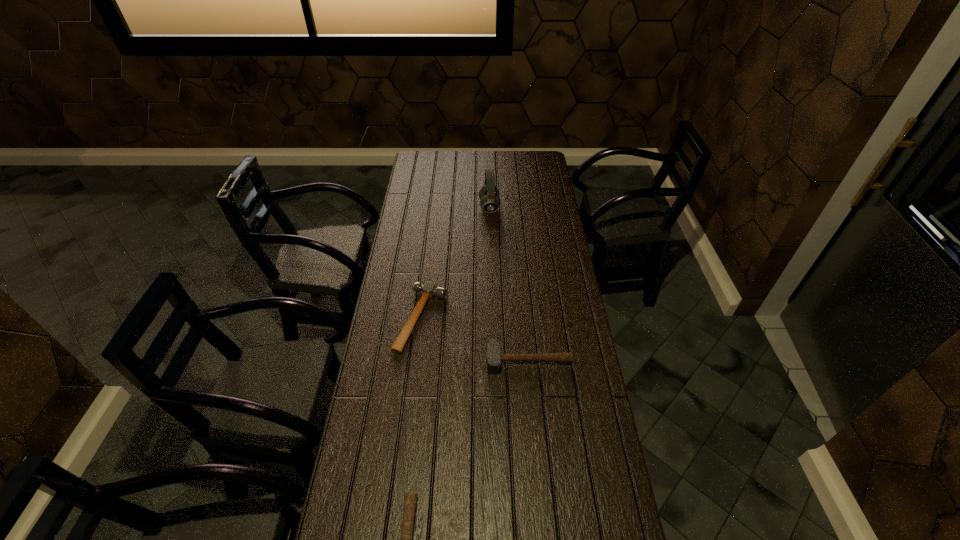
This screenshot has width=960, height=540. I want to click on the tallest object, so click(489, 198).

Image resolution: width=960 pixels, height=540 pixels. I want to click on headset, so [x=489, y=198].

The image size is (960, 540). What are the coordinates of `the rightmost hammer` in the screenshot? It's located at (493, 357).

This screenshot has height=540, width=960. Find the location of `the second shortest object`. the second shortest object is located at coordinates click(429, 289).

Locate an element on the screen. vacant space located on the ear cups of the tallest object is located at coordinates (427, 207).

The width and height of the screenshot is (960, 540). Identify the location of vacant space located on the ear cups of the tallest object. (467, 207).

This screenshot has height=540, width=960. What are the coordinates of `vacant space located 0.170m on the ear cups of the tallest object` in the screenshot? It's located at (444, 207).

Locate an element on the screen. This screenshot has height=540, width=960. vacant region located on the striking surface of the rightmost hammer is located at coordinates (534, 423).

At what (x,y) coordinates should I click in order to perform the action: click on vacant space situated 0.200m on the front of the second shortest object. Please return your answer as a coordinate pair (x, y). Looking at the image, I should click on (410, 406).

This screenshot has width=960, height=540. Identify the location of object located in the left edge section of the desktop. click(x=429, y=289).